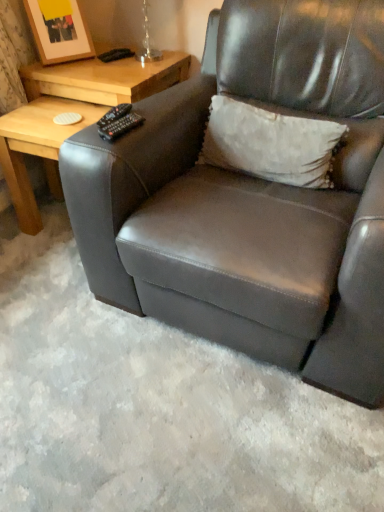
This screenshot has height=512, width=384. In order to click on vacant area situated below wooden picture frame at upper left (from a real-world perspective) in this screenshot , I will do tap(63, 64).